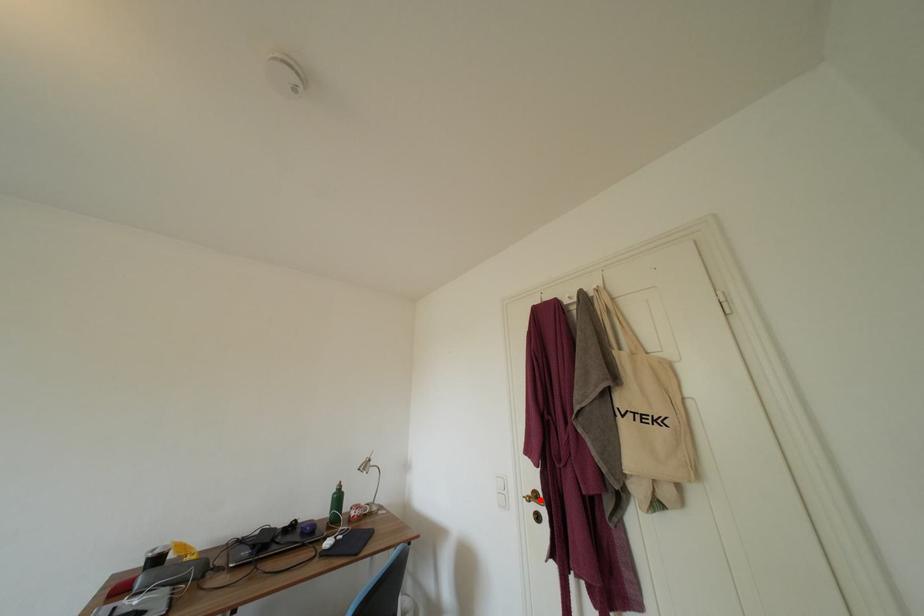
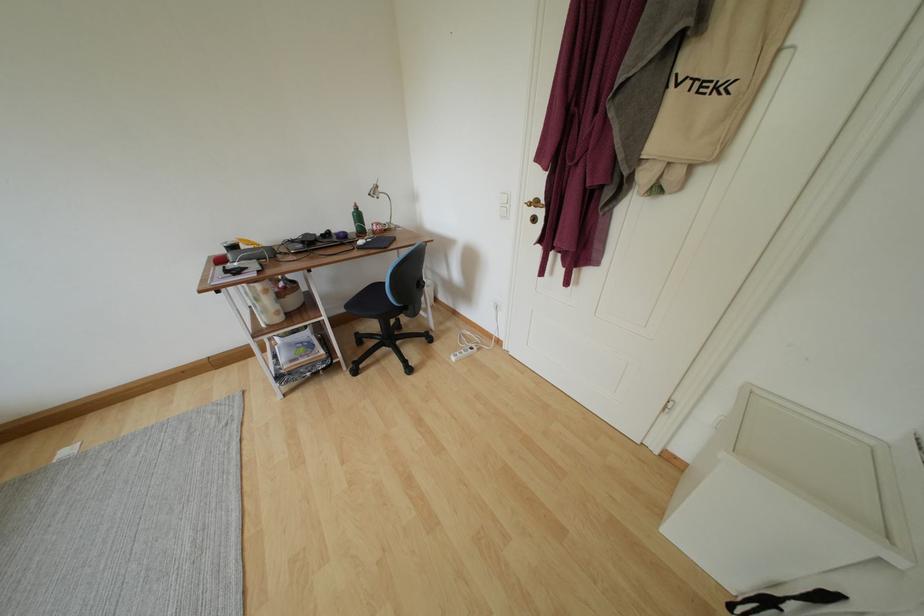
Question: I am providing you with two images of the same scene from different viewpoints. Image1 has a red point marked. In image2, the corresponding 3D location appears at what relative position? Reply with the corresponding letter.

Choices:
 (A) Closer
 (B) Farther

Answer: (A)